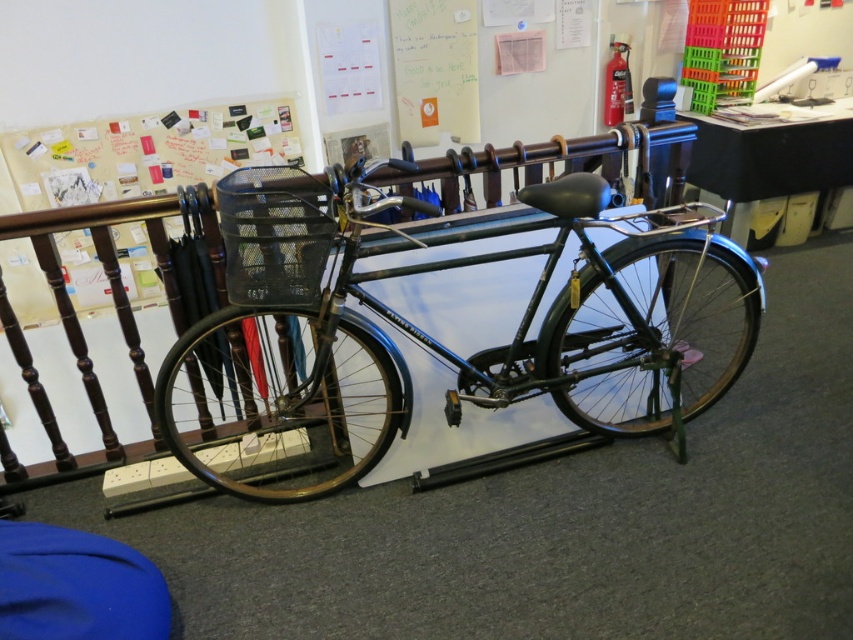
Question: Which of the following is the closest to the observer?

Choices:
 (A) shiny black bicycle at center
 (B) white paperboard at upper left

Answer: (A)

Question: Among these points, which one is farthest from the camera?

Choices:
 (A) pyautogui.click(x=262, y=216)
 (B) pyautogui.click(x=160, y=131)

Answer: (B)

Question: Does shiny black bicycle at center lie behind white paperboard at upper left?

Choices:
 (A) no
 (B) yes

Answer: (A)

Question: Is shiny black bicycle at center closer to the viewer compared to white paperboard at upper left?

Choices:
 (A) no
 (B) yes

Answer: (B)

Question: In this image, where is shiny black bicycle at center located relative to white paperboard at upper left?

Choices:
 (A) above
 (B) below

Answer: (B)